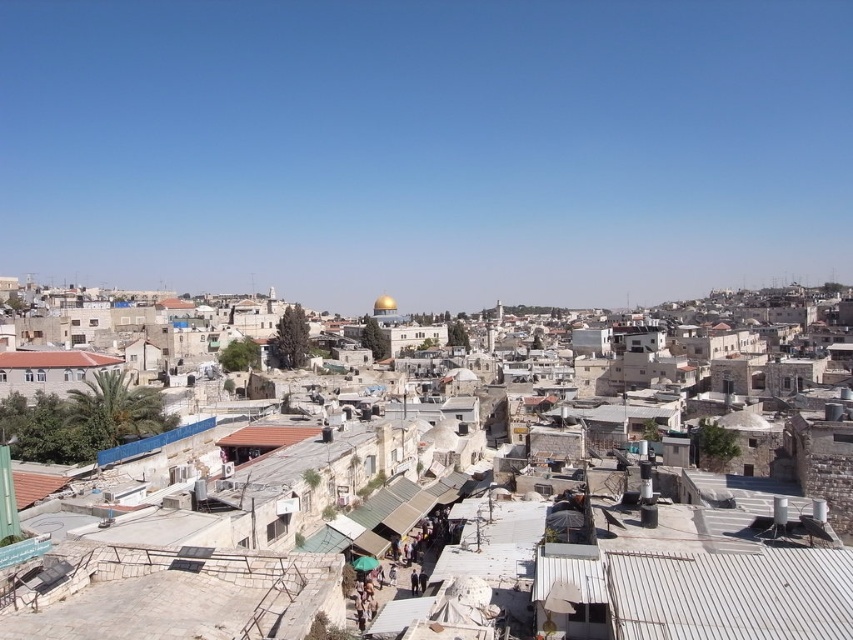
Locate an element on the screen. This screenshot has width=853, height=640. stone buildings at center is located at coordinates (695, 579).

Consider the image. Which is above, stone buildings at center or brown tile roof at lower left?

brown tile roof at lower left is above.

Find the location of a particular element. Image resolution: width=853 pixels, height=640 pixels. stone buildings at center is located at coordinates (695, 579).